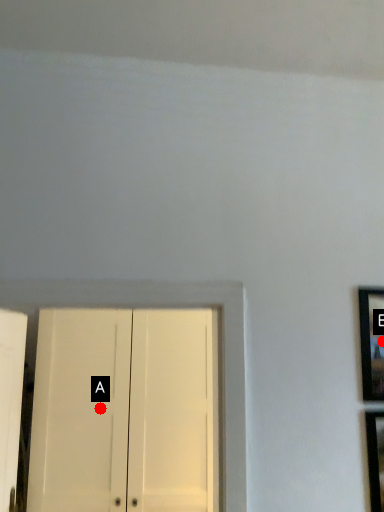
Question: Two points are circled on the image, labeled by A and B beside each circle. Which point is farther to the camera?

Choices:
 (A) A is further
 (B) B is further

Answer: (A)